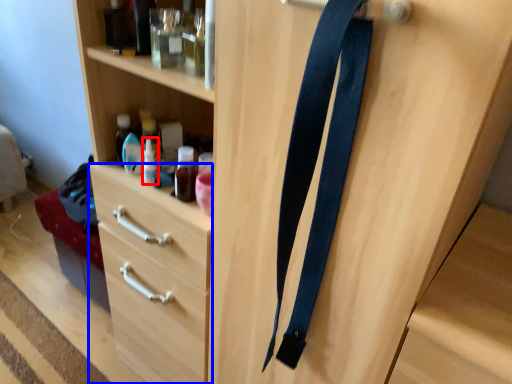
Question: Which of the following is the farthest to the observer, bottle (highlighted by a red box) or drawer (highlighted by a blue box)?

Choices:
 (A) bottle
 (B) drawer

Answer: (B)